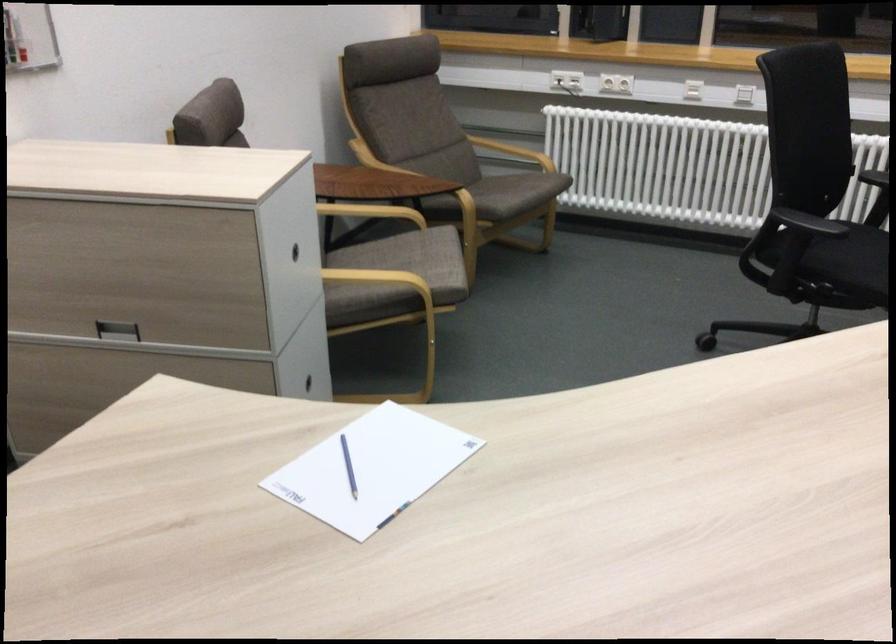
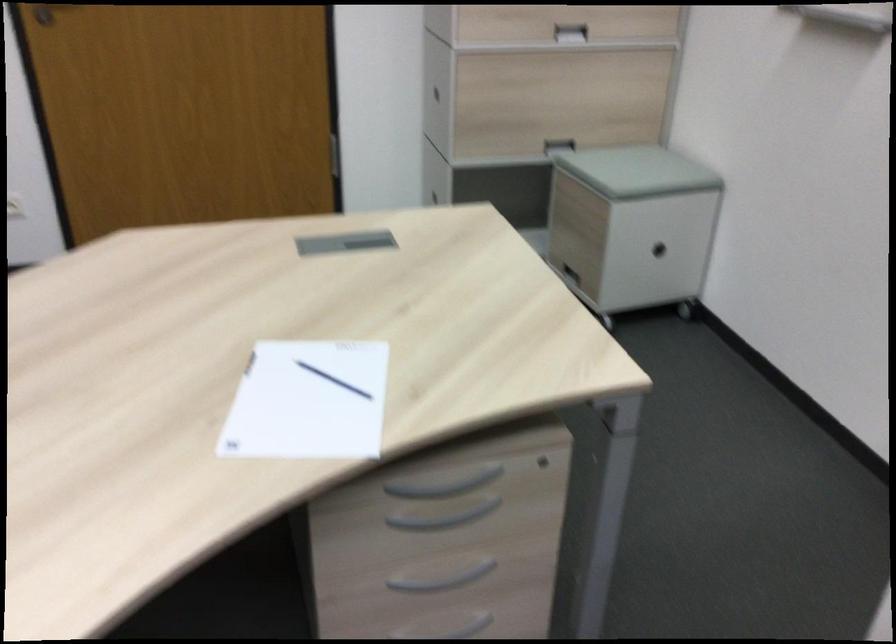
Where in the second image is the point corresponding to [334,482] from the first image?

(333, 380)